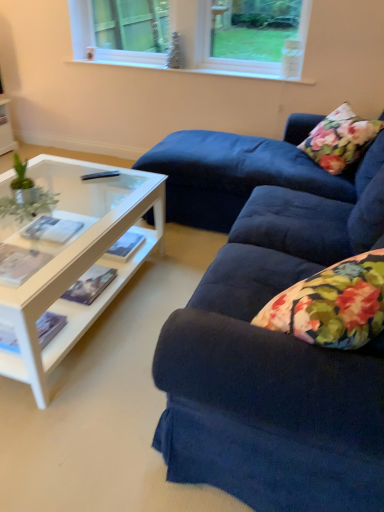
Question: From a real-world perspective, is green leafy plant at left physically located above or below velvet blue couch at right?

Choices:
 (A) below
 (B) above

Answer: (B)

Question: Is green leafy plant at left to the left or to the right of velvet blue couch at right in the image?

Choices:
 (A) left
 (B) right

Answer: (A)

Question: Which object is the farthest from the white plastic window at upper center?

Choices:
 (A) velvet blue couch at right
 (B) green leafy plant at left
 (C) floral fabric pillow at upper right
 (D) black plastic remote control at center

Answer: (A)

Question: Which object is positioned farthest from the velvet blue couch at right?

Choices:
 (A) black plastic remote control at center
 (B) floral fabric pillow at upper right
 (C) white plastic window at upper center
 (D) green leafy plant at left

Answer: (C)